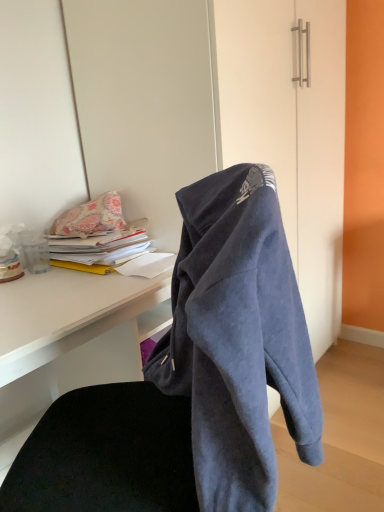
Question: Is matte white desk at center further to camera compared to yellow paper at left?

Choices:
 (A) yes
 (B) no

Answer: (B)

Question: From the image's perspective, does matte white desk at center appear higher than yellow paper at left?

Choices:
 (A) no
 (B) yes

Answer: (A)

Question: Is matte white desk at center touching yellow paper at left?

Choices:
 (A) yes
 (B) no

Answer: (B)

Question: Can you confirm if matte white desk at center is bigger than yellow paper at left?

Choices:
 (A) no
 (B) yes

Answer: (B)

Question: Is matte white desk at center smaller than yellow paper at left?

Choices:
 (A) yes
 (B) no

Answer: (B)

Question: Is matte white desk at center to the right of yellow paper at left from the viewer's perspective?

Choices:
 (A) yes
 (B) no

Answer: (B)

Question: From the image's perspective, is matte white desk at center on floral fabric pillow at upper left?

Choices:
 (A) yes
 (B) no

Answer: (B)

Question: Does matte white desk at center appear on the right side of floral fabric pillow at upper left?

Choices:
 (A) yes
 (B) no

Answer: (A)

Question: Does matte white desk at center contain floral fabric pillow at upper left?

Choices:
 (A) no
 (B) yes

Answer: (A)

Question: Does matte white desk at center come behind floral fabric pillow at upper left?

Choices:
 (A) yes
 (B) no

Answer: (B)

Question: Can you see matte white desk at center touching floral fabric pillow at upper left?

Choices:
 (A) no
 (B) yes

Answer: (A)

Question: Considering the relative sizes of matte white desk at center and floral fabric pillow at upper left in the image provided, is matte white desk at center smaller than floral fabric pillow at upper left?

Choices:
 (A) yes
 (B) no

Answer: (B)

Question: Can you confirm if dark blue fleece hoodie at center is shorter than floral fabric pillow at upper left?

Choices:
 (A) no
 (B) yes

Answer: (A)